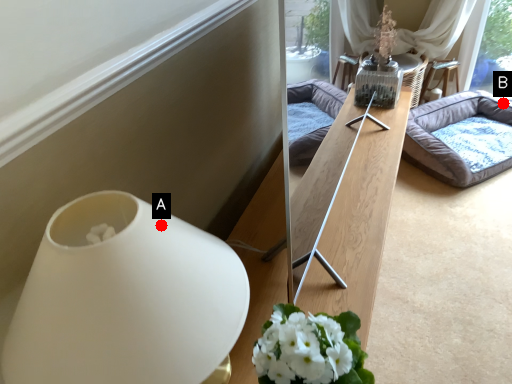
Question: Two points are circled on the image, labeled by A and B beside each circle. Which point appears closest to the camera in this image?

Choices:
 (A) A is closer
 (B) B is closer

Answer: (A)